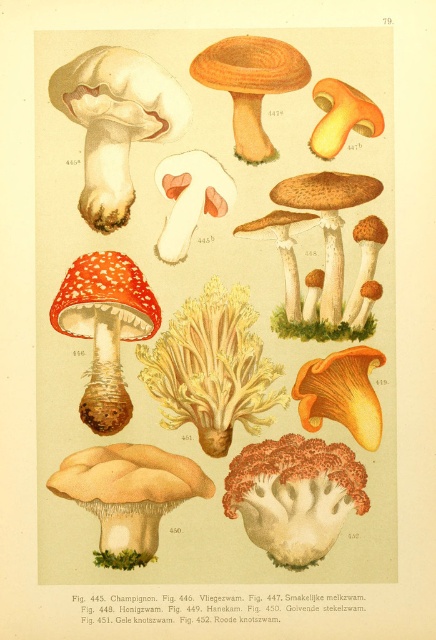
Based on the provided botanical illustration, which mushroom is located at the coordinates point (129, 496)?

The beige matte mushroom at lower left is located at point (129, 496).

You are an amateur mycologist examining the botanical illustration. You notice the matte white mushroom at upper left and the smooth orange cap at center. Which mushroom appears closer to you in the illustration?

The matte white mushroom at upper left appears closer to you because it is further to the viewer than the smooth orange cap at center.

You are an entomologist examining the botanical illustration. You need to locate the smooth orange mushroom at center. According to the grid coordinates provided in the illustration, where would you find it?

The smooth orange mushroom at center is located at point (341, 394).